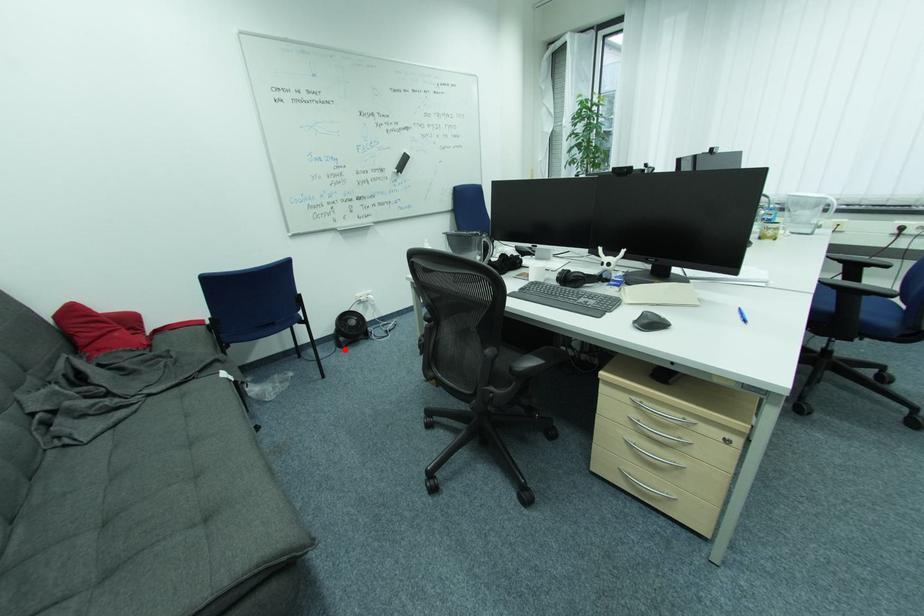
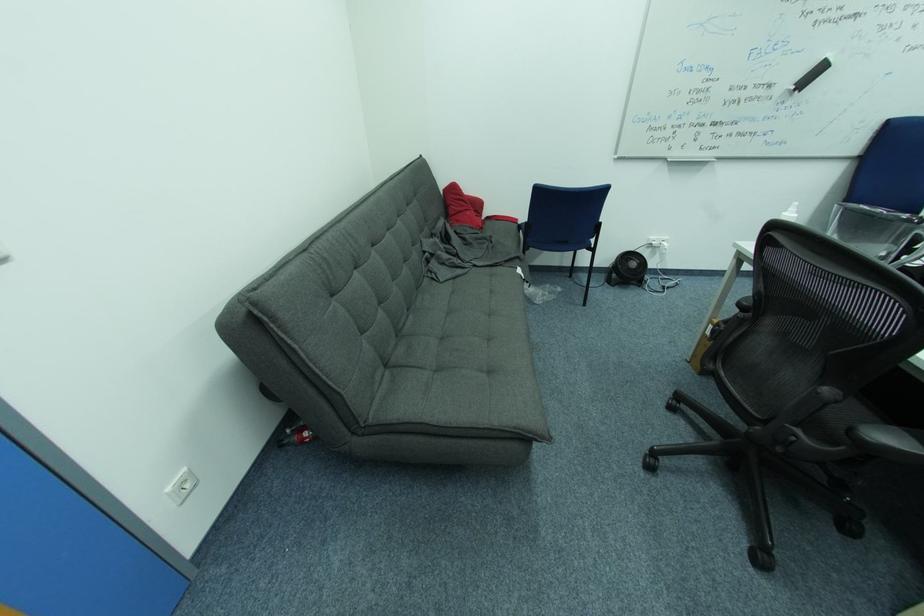
Question: A red point is marked in image1. In image2, is the corresponding 3D point closer to the camera or farther? Reply with the corresponding letter.

Choices:
 (A) The corresponding 3D point is closer.
 (B) The corresponding 3D point is farther.

Answer: (B)